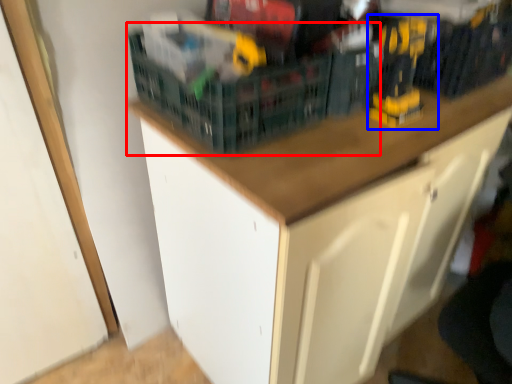
Question: Which point is further to the camera, basket (highlighted by a red box) or toy (highlighted by a blue box)?

Choices:
 (A) basket
 (B) toy

Answer: (B)